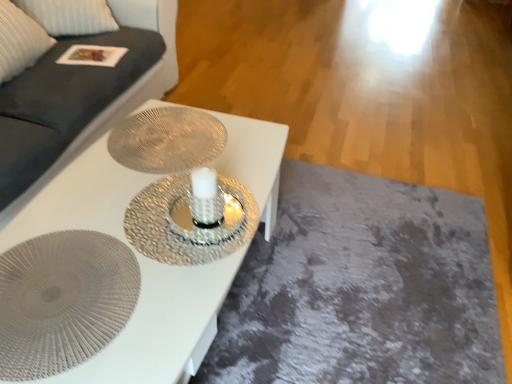
Question: From the image's perspective, is metallic textured plate at center, marked as the 1th oval in a top-to-bottom arrangement, located above white textured table at center?

Choices:
 (A) no
 (B) yes

Answer: (B)

Question: Can you confirm if metallic textured plate at center, the 2th oval when ordered from front to back, is shorter than white textured table at center?

Choices:
 (A) yes
 (B) no

Answer: (A)

Question: From a real-world perspective, is metallic textured plate at center, positioned as the 1th oval in back-to-front order, on top of white textured table at center?

Choices:
 (A) no
 (B) yes

Answer: (B)

Question: Can you confirm if metallic textured plate at center, the 2th oval when ordered from front to back, is smaller than white textured table at center?

Choices:
 (A) no
 (B) yes

Answer: (B)

Question: Is metallic textured plate at center, positioned as the 1th oval in back-to-front order, at the right side of white textured table at center?

Choices:
 (A) no
 (B) yes

Answer: (B)

Question: From the image's perspective, is white textured table at center above or below dark gray fabric couch at upper left?

Choices:
 (A) above
 (B) below

Answer: (B)

Question: Is white textured table at center situated inside dark gray fabric couch at upper left or outside?

Choices:
 (A) outside
 (B) inside

Answer: (A)

Question: Considering the positions of white textured table at center and dark gray fabric couch at upper left in the image, is white textured table at center taller or shorter than dark gray fabric couch at upper left?

Choices:
 (A) short
 (B) tall

Answer: (A)

Question: Is point (123, 173) closer or farther from the camera than point (3, 1)?

Choices:
 (A) farther
 (B) closer

Answer: (B)

Question: Based on their sizes in the image, would you say textured silver plate at center, positioned as the first oval in front-to-back order, is bigger or smaller than dark gray fabric couch at upper left?

Choices:
 (A) small
 (B) big

Answer: (A)

Question: Visually, is textured silver plate at center, the 1th oval when ordered from bottom to top, positioned to the left or to the right of dark gray fabric couch at upper left?

Choices:
 (A) right
 (B) left

Answer: (A)

Question: Considering the positions of textured silver plate at center, the 1th oval when ordered from bottom to top, and dark gray fabric couch at upper left in the image, is textured silver plate at center, the 1th oval when ordered from bottom to top, wider or thinner than dark gray fabric couch at upper left?

Choices:
 (A) thin
 (B) wide

Answer: (A)

Question: In terms of height, does textured silver plate at center, which is the 2th oval in top-to-bottom order, look taller or shorter compared to dark gray fabric couch at upper left?

Choices:
 (A) tall
 (B) short

Answer: (B)

Question: Based on their positions, is metallic textured plate at center, marked as the 1th oval in a top-to-bottom arrangement, located to the left or right of white textured table at center?

Choices:
 (A) right
 (B) left

Answer: (A)

Question: Does point (138, 168) appear closer or farther from the camera than point (124, 380)?

Choices:
 (A) closer
 (B) farther

Answer: (B)